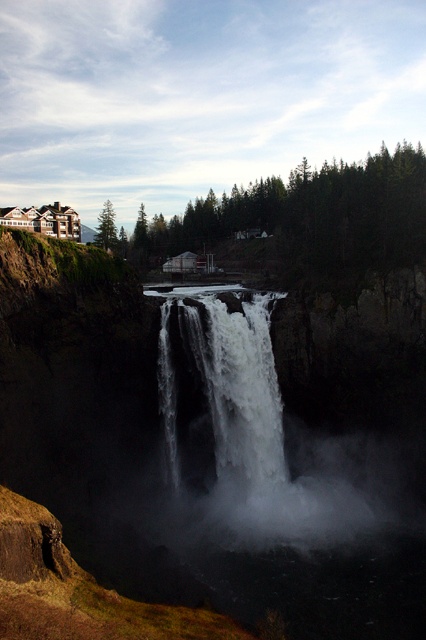
Question: Does white frothy water at center come behind green matte tree at upper left?

Choices:
 (A) yes
 (B) no

Answer: (B)

Question: Can you confirm if green matte tree at upper center is positioned below green matte tree at upper left?

Choices:
 (A) yes
 (B) no

Answer: (B)

Question: Estimate the real-world distances between objects in this image. Which object is farther from the white misty steam at center?

Choices:
 (A) green matte tree at upper center
 (B) white frothy water at center
 (C) green matte tree at upper left

Answer: (C)

Question: Based on their relative distances, which object is nearer to the green matte tree at upper center?

Choices:
 (A) white frothy water at center
 (B) green matte tree at upper left
 (C) white misty steam at center

Answer: (C)

Question: Which of the following is the farthest from the observer?

Choices:
 (A) white misty steam at center
 (B) white frothy water at center
 (C) green matte tree at upper left
 (D) green matte tree at upper center

Answer: (C)

Question: Does white misty steam at center lie in front of green matte tree at upper left?

Choices:
 (A) yes
 (B) no

Answer: (A)